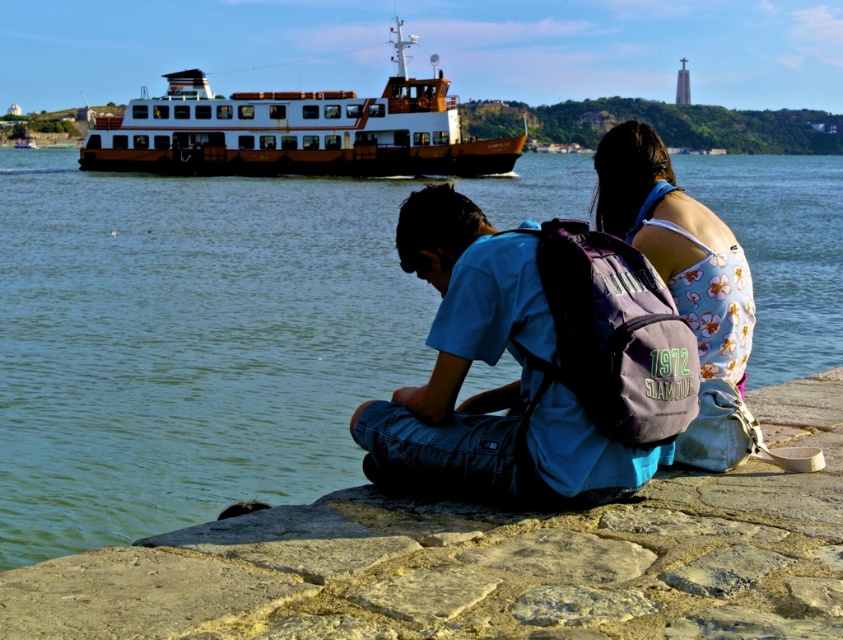
Consider the image. You are a photographer planning to take a wide shot of the blue cotton shirt at center and the brown wooden ferry at upper left. Based on the scene, which object should you focus on first to ensure both are in frame?

The blue cotton shirt at center has a lesser width compared to the brown wooden ferry at upper left, so you should focus on the brown wooden ferry at upper left first to ensure both fit in the frame.